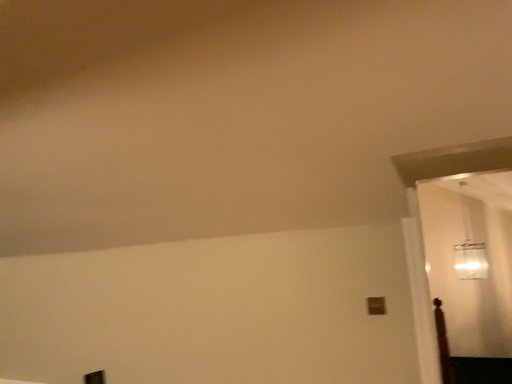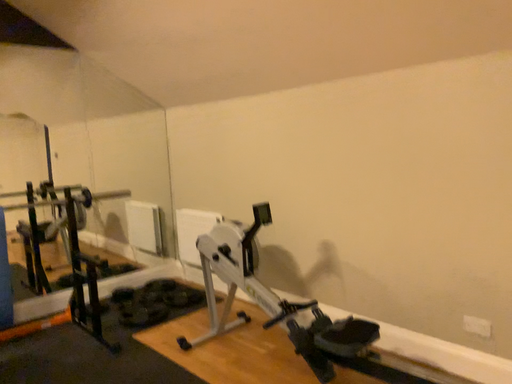
Question: Which way did the camera rotate in the video?

Choices:
 (A) rotated right
 (B) rotated left

Answer: (B)